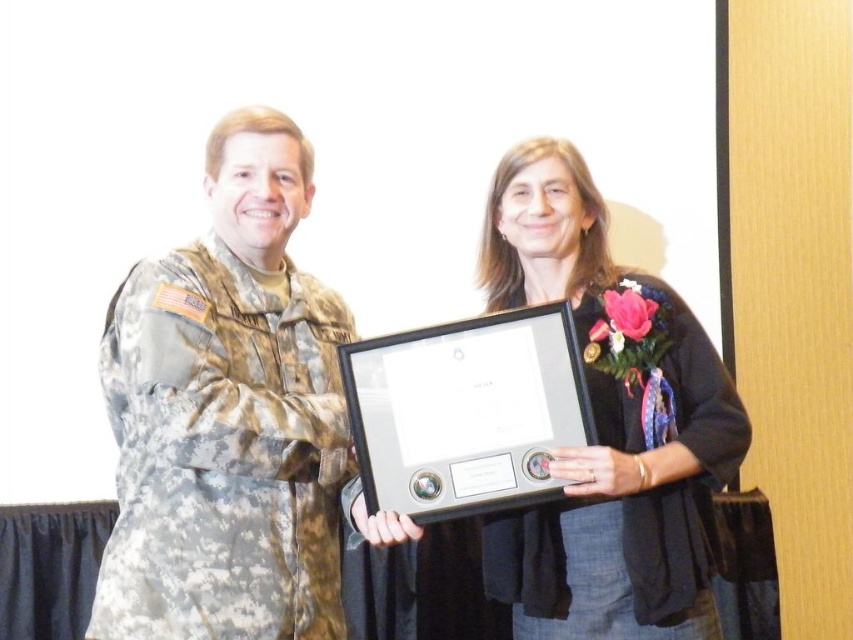
Question: Does matte black frame at center appear under camouflage fabric uniform at left?

Choices:
 (A) yes
 (B) no

Answer: (B)

Question: Which object is farther from the camera taking this photo?

Choices:
 (A) camouflage fabric uniform at left
 (B) matte black uniform at center
 (C) matte black frame at center

Answer: (B)

Question: Among these points, which one is nearest to the camera?

Choices:
 (A) (322, 476)
 (B) (263, 163)
 (C) (495, 556)

Answer: (A)

Question: Can you confirm if matte black frame at center is positioned to the right of matte black uniform at center?

Choices:
 (A) yes
 (B) no

Answer: (B)

Question: Based on their relative distances, which object is farther from the camouflage fabric uniform at left?

Choices:
 (A) matte black uniform at center
 (B) matte black frame at center

Answer: (A)

Question: Is the position of matte black frame at center more distant than that of matte black uniform at center?

Choices:
 (A) no
 (B) yes

Answer: (A)